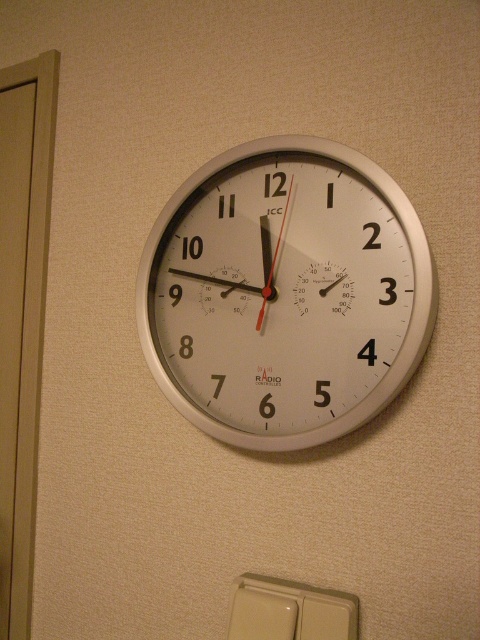
Which is in front, point (314, 280) or point (347, 600)?

Positioned in front is point (347, 600).

Is point (279, 330) closer to camera compared to point (269, 636)?

That is False.

Who is more distant from viewer, (197, 358) or (264, 592)?

The point (197, 358) is behind.

Where is `white metallic clock at center`? white metallic clock at center is located at coordinates (285, 292).